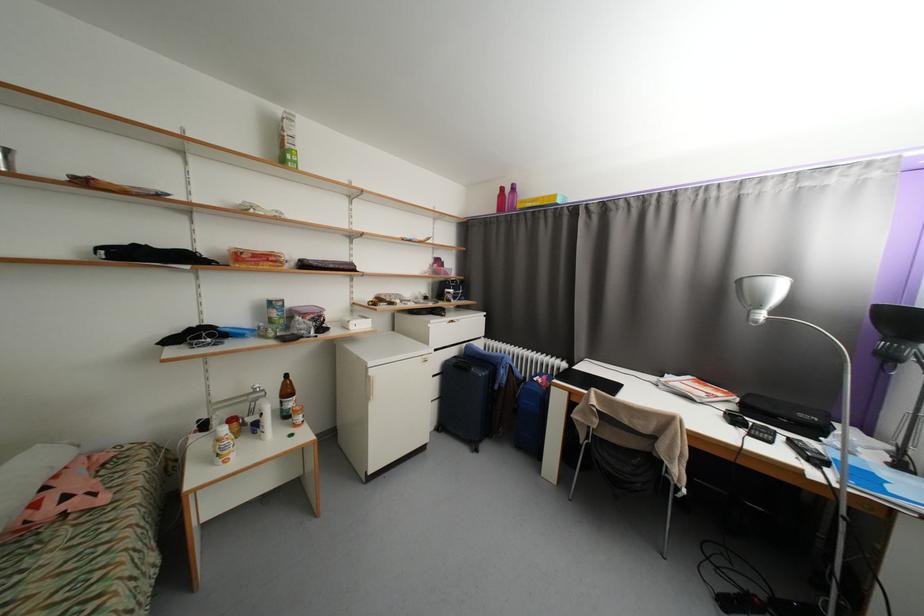
The location [264,419] corresponds to which object?

It refers to a white plastic bottle.